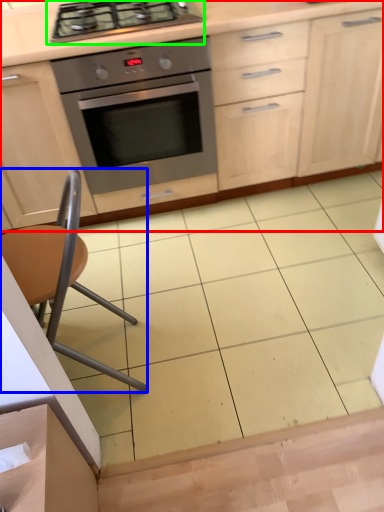
Question: Which object is positioned closest to cabinetry (highlighted by a red box)? Select from chair (highlighted by a blue box) and gas stove (highlighted by a green box).

Choices:
 (A) chair
 (B) gas stove

Answer: (B)